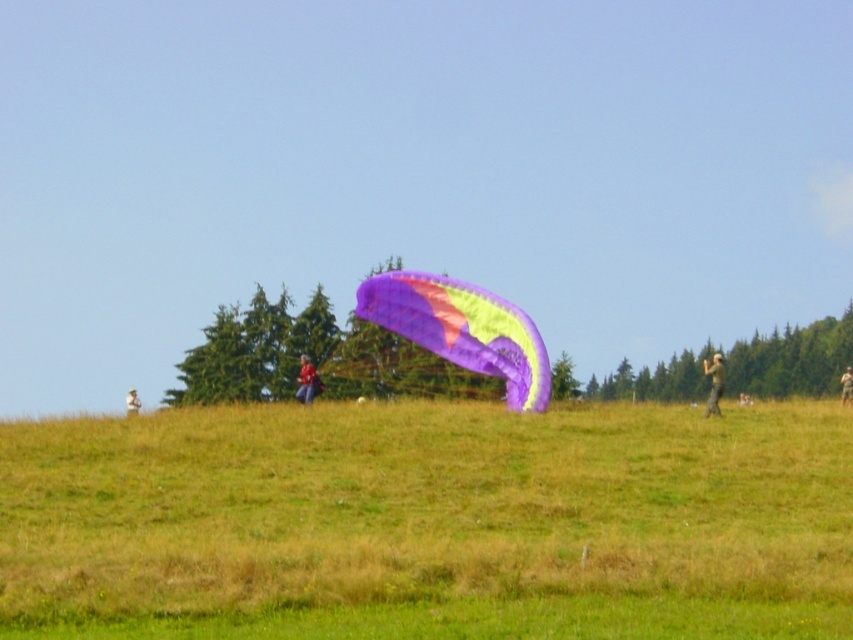
You are standing at the center of the image. Which direction should you walk to reach the green grassy field at center?

The green grassy field at center is already at the center of the image, so you are already at the green grassy field at center.

You are planning to lay out a picnic blanket in the green grassy field at center. Considering the space available, will the translucent purple kite at center interfere with placing the blanket?

The green grassy field at center is wider than the translucent purple kite at center, so there is enough space to place the picnic blanket without interference from the kite.

You are standing in the middle of the green grassy field at center and want to pick up the light brown fabric jacket at center. Which direction should you move to reach the jacket?

The green grassy field at center is to the right of the light brown fabric jacket at center, so you should move to your left to reach the jacket.